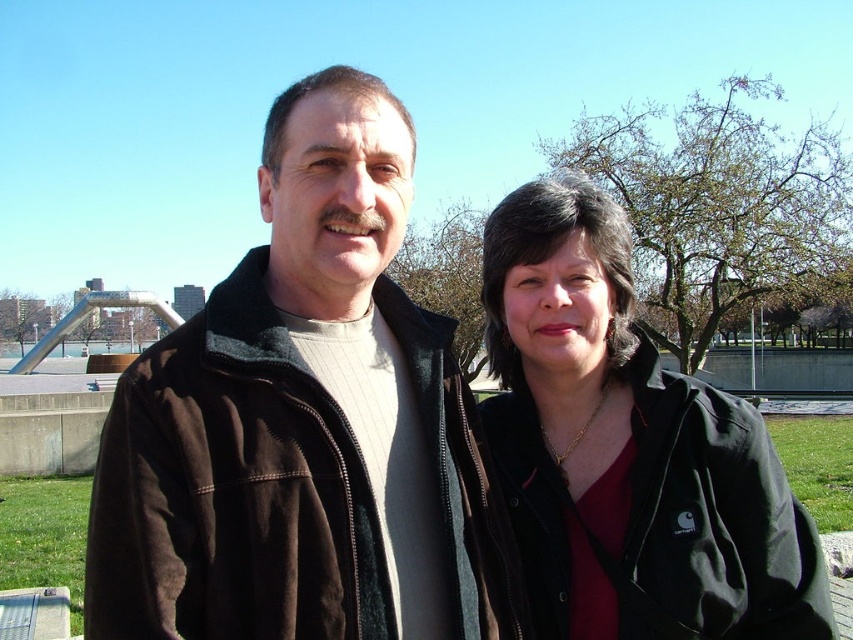
Question: Is brown fleece jacket at center thinner than black matte jacket at center?

Choices:
 (A) yes
 (B) no

Answer: (A)

Question: Where is brown fleece jacket at center located in relation to black matte jacket at center in the image?

Choices:
 (A) below
 (B) above

Answer: (B)

Question: Is brown fleece jacket at center smaller than black matte jacket at center?

Choices:
 (A) yes
 (B) no

Answer: (A)

Question: Which object is farther from the camera taking this photo?

Choices:
 (A) brown fleece jacket at center
 (B) black matte jacket at center

Answer: (B)